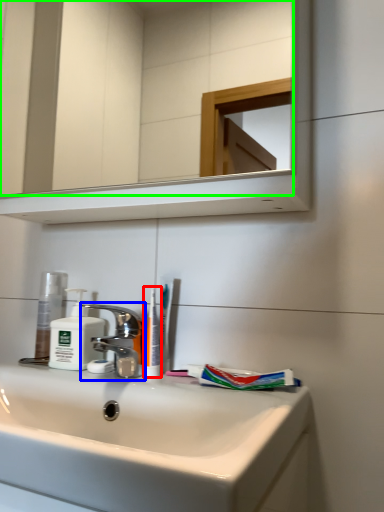
Question: Which object is the farthest from toothbrush (highlighted by a red box)? Choose among these: tap (highlighted by a blue box) or mirror (highlighted by a green box).

Choices:
 (A) tap
 (B) mirror

Answer: (B)